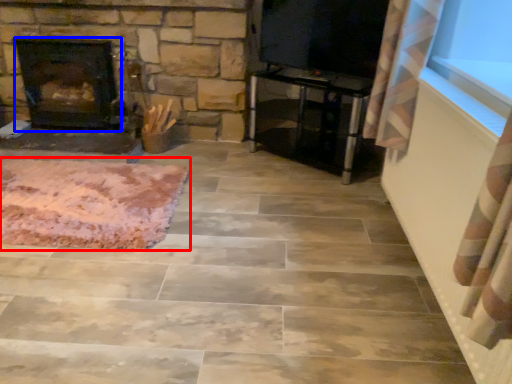
Question: Which object appears farthest to the camera in this image, mat (highlighted by a red box) or fireplace (highlighted by a blue box)?

Choices:
 (A) mat
 (B) fireplace

Answer: (B)